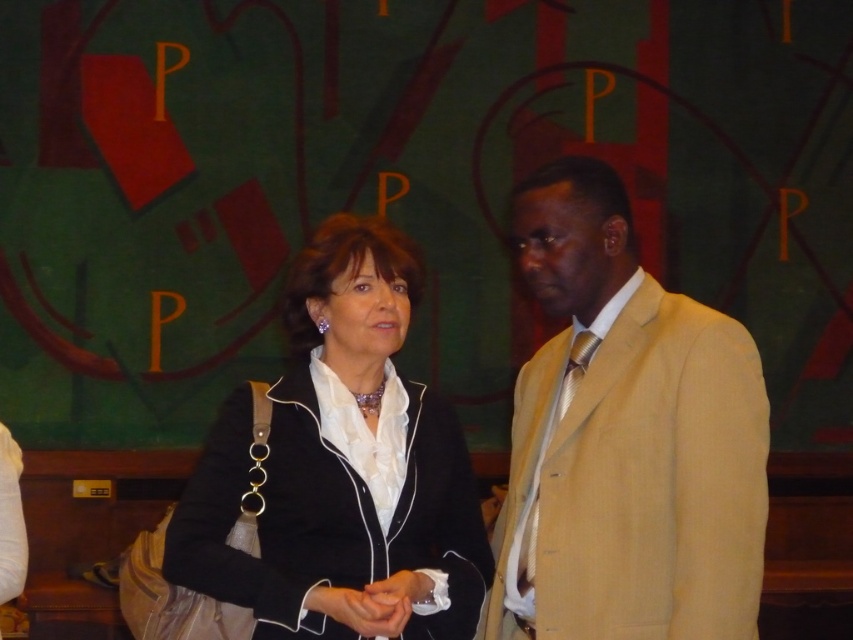
Question: Observing the image, what is the correct spatial positioning of tan textured suit at center in reference to black satin blazer at center?

Choices:
 (A) above
 (B) below

Answer: (A)

Question: Is tan textured suit at center to the left of black satin blazer at center from the viewer's perspective?

Choices:
 (A) no
 (B) yes

Answer: (A)

Question: Can you confirm if tan textured suit at center is bigger than black satin blazer at center?

Choices:
 (A) yes
 (B) no

Answer: (A)

Question: Which point is closer to the camera?

Choices:
 (A) tan textured suit at center
 (B) black satin blazer at center

Answer: (A)

Question: Which of the following is the closest to the observer?

Choices:
 (A) (386, 545)
 (B) (627, 532)

Answer: (B)